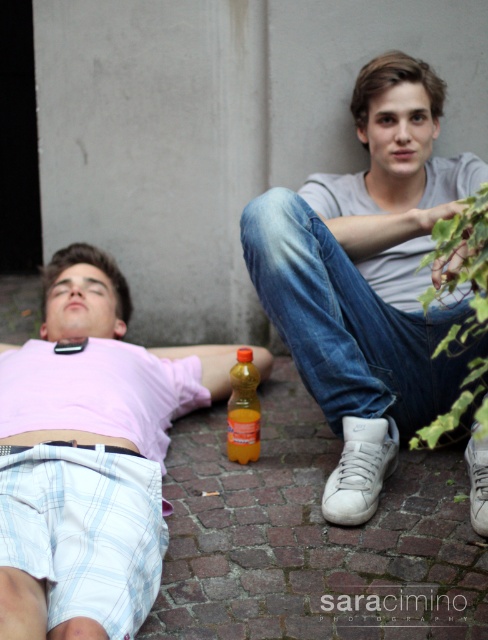
Does white matte sneakers at lower right have a lesser width compared to translucent orange bottle at center?

In fact, white matte sneakers at lower right might be wider than translucent orange bottle at center.

At what (x,y) coordinates should I click in order to perform the action: click on white matte sneakers at lower right. Please return your answer as a coordinate pair (x, y). The image size is (488, 640). Looking at the image, I should click on (367, 278).

What do you see at coordinates (367, 278) in the screenshot? This screenshot has width=488, height=640. I see `white matte sneakers at lower right` at bounding box center [367, 278].

Where is `white matte sneakers at lower right`? white matte sneakers at lower right is located at coordinates (367, 278).

Is white matte sneakers at lower right taller than white plaid shorts at lower left?

Indeed, white matte sneakers at lower right has a greater height compared to white plaid shorts at lower left.

Between point (412, 152) and point (95, 284), which one is positioned in front?

Point (412, 152) is more forward.

At what (x,y) coordinates should I click in order to perform the action: click on white matte sneakers at lower right. Please return your answer as a coordinate pair (x, y). The width and height of the screenshot is (488, 640). Looking at the image, I should click on (367, 278).

Can you confirm if white plaid shorts at lower left is smaller than translucent orange bottle at center?

No.

Does white plaid shorts at lower left appear on the right side of translucent orange bottle at center?

In fact, white plaid shorts at lower left is to the left of translucent orange bottle at center.

Does point (81, 636) come closer to viewer compared to point (247, 420)?

Yes, it is in front of point (247, 420).

This screenshot has height=640, width=488. I want to click on white plaid shorts at lower left, so click(x=121, y=355).